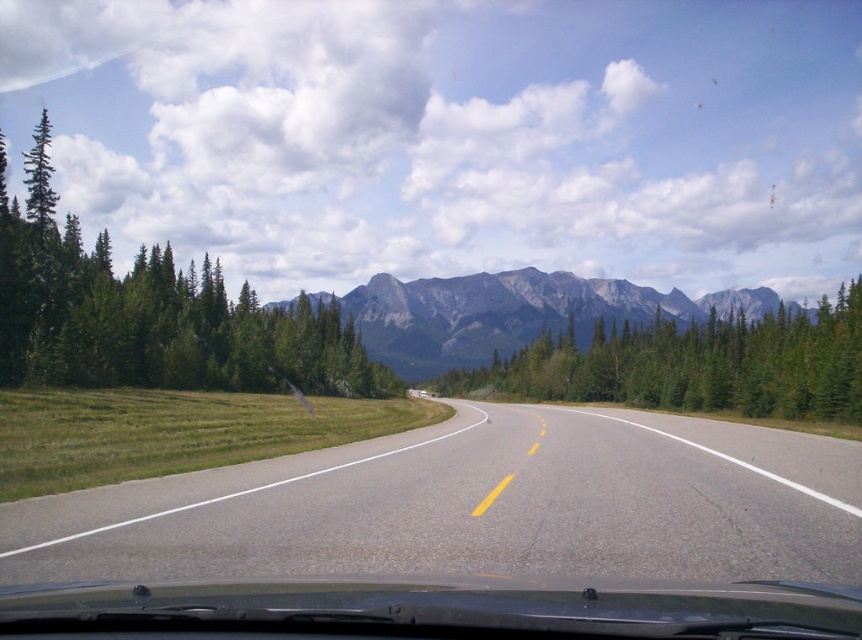
Question: Considering the real-world distances, which object is closest to the smooth asphalt highway at center?

Choices:
 (A) gray rocky mountain at center
 (B) transparent glass windshield at center

Answer: (B)

Question: Among these objects, which one is nearest to the camera?

Choices:
 (A) transparent glass windshield at center
 (B) smooth asphalt highway at center
 (C) green matte tree at left
 (D) gray rocky mountain at center

Answer: (A)

Question: Does smooth asphalt highway at center have a lesser width compared to gray rocky mountain at center?

Choices:
 (A) yes
 (B) no

Answer: (A)

Question: Is transparent glass windshield at center positioned in front of gray rocky mountain at center?

Choices:
 (A) no
 (B) yes

Answer: (B)

Question: Does green matte tree at left lie in front of transparent glass windshield at center?

Choices:
 (A) yes
 (B) no

Answer: (B)

Question: Which of the following is the closest to the observer?

Choices:
 (A) gray rocky mountain at center
 (B) green textured pine trees at center

Answer: (B)